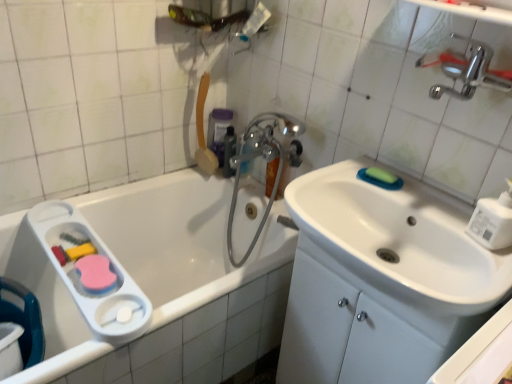
Question: Is chrome metallic faucet at upper center closer to the viewer compared to semi-transparent plastic bottle at upper center, acting as the 2th mouthwash starting from the back?

Choices:
 (A) yes
 (B) no

Answer: (A)

Question: Is chrome metallic faucet at upper center smaller than semi-transparent plastic bottle at upper center, acting as the 2th mouthwash starting from the back?

Choices:
 (A) no
 (B) yes

Answer: (A)

Question: From a real-world perspective, is chrome metallic faucet at upper center physically above semi-transparent plastic bottle at upper center, which ranks as the first mouthwash in front-to-back order?

Choices:
 (A) yes
 (B) no

Answer: (B)

Question: Would you consider chrome metallic faucet at upper center to be distant from semi-transparent plastic bottle at upper center, acting as the 2th mouthwash starting from the back?

Choices:
 (A) no
 (B) yes

Answer: (A)

Question: From the image's perspective, is chrome metallic faucet at upper center on semi-transparent plastic bottle at upper center, which ranks as the first mouthwash in front-to-back order?

Choices:
 (A) no
 (B) yes

Answer: (A)

Question: From the image's perspective, is chrome metallic faucet at upper center above or below purple plastic mouthwash at upper center, the second mouthwash when ordered from front to back?

Choices:
 (A) above
 (B) below

Answer: (B)

Question: From a real-world perspective, is chrome metallic faucet at upper center positioned above or below purple plastic mouthwash at upper center, the second mouthwash when ordered from front to back?

Choices:
 (A) below
 (B) above

Answer: (A)

Question: In terms of height, does chrome metallic faucet at upper center look taller or shorter compared to purple plastic mouthwash at upper center, the second mouthwash when ordered from front to back?

Choices:
 (A) short
 (B) tall

Answer: (B)

Question: In the image, is chrome metallic faucet at upper center positioned in front of or behind purple plastic mouthwash at upper center, positioned as the 1th mouthwash in back-to-front order?

Choices:
 (A) front
 (B) behind

Answer: (A)

Question: Choose the correct answer: Is purple plastic mouthwash at upper center, the second mouthwash when ordered from front to back, inside chrome metallic faucet at upper center or outside it?

Choices:
 (A) inside
 (B) outside

Answer: (B)

Question: In terms of width, does purple plastic mouthwash at upper center, the second mouthwash when ordered from front to back, look wider or thinner when compared to chrome metallic faucet at upper center?

Choices:
 (A) wide
 (B) thin

Answer: (B)

Question: From their relative heights in the image, would you say purple plastic mouthwash at upper center, the second mouthwash when ordered from front to back, is taller or shorter than chrome metallic faucet at upper center?

Choices:
 (A) tall
 (B) short

Answer: (B)

Question: From a real-world perspective, is purple plastic mouthwash at upper center, positioned as the 1th mouthwash in back-to-front order, physically located above or below chrome metallic faucet at upper center?

Choices:
 (A) above
 (B) below

Answer: (A)

Question: Considering the positions of point (226, 130) and point (270, 175), is point (226, 130) closer or farther from the camera than point (270, 175)?

Choices:
 (A) farther
 (B) closer

Answer: (A)

Question: From a real-world perspective, relative to chrome metallic faucet at upper center, is semi-transparent plastic bottle at upper center, which ranks as the first mouthwash in front-to-back order, vertically above or below?

Choices:
 (A) below
 (B) above

Answer: (B)